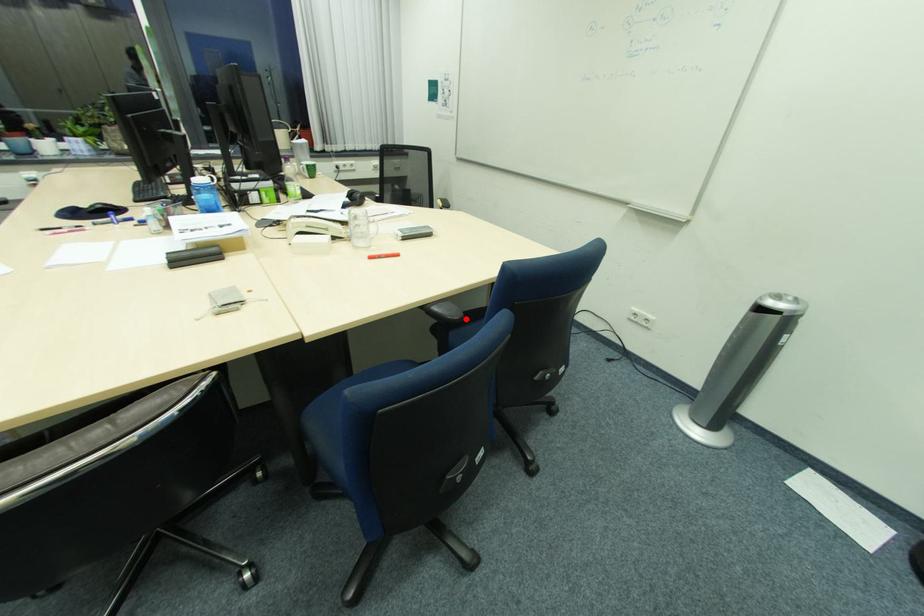
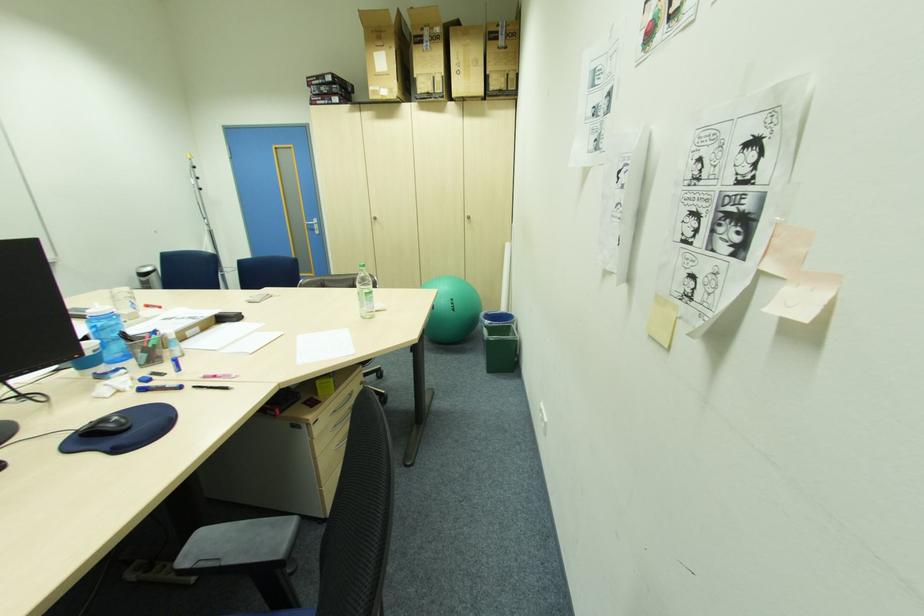
Question: I am providing you with two images of the same scene from different viewpoints. A red point is marked on the first image. At the location where the point appears in image 1, is it still visible in image 2?

Choices:
 (A) Yes
 (B) No

Answer: (B)